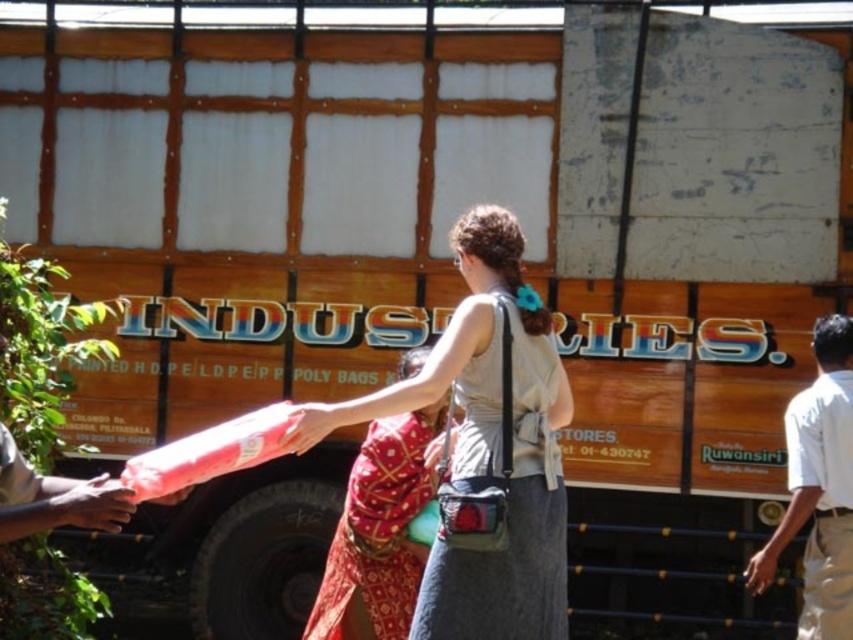
Consider the image. Can you confirm if pink fabric at center is positioned above matte black hand at lower right?

Yes, pink fabric at center is above matte black hand at lower right.

Can you confirm if pink fabric at center is positioned to the left of matte black hand at lower right?

Indeed, pink fabric at center is positioned on the left side of matte black hand at lower right.

Between point (337, 404) and point (752, 584), which one is positioned behind?

The point (337, 404) is more distant.

Find the location of a particular element. pink fabric at center is located at coordinates (309, 426).

Can you confirm if red printed pants at center is shorter than matte red bag at center?

No, red printed pants at center is not shorter than matte red bag at center.

Is point (338, 592) positioned after point (436, 468)?

Yes.

Identify the location of red printed pants at center. This screenshot has width=853, height=640. (378, 532).

Find the location of a particular element. This screenshot has width=853, height=640. red printed pants at center is located at coordinates (378, 532).

Between smooth skin hand at lower left and matte red bag at center, which one is positioned lower?

smooth skin hand at lower left is below.

Is smooth skin hand at lower left thinner than matte red bag at center?

Incorrect, smooth skin hand at lower left's width is not less than matte red bag at center's.

You are a GUI agent. You are given a task and a screenshot of the screen. Output one action in this format:
    pyautogui.click(x=<x>, y=<y>)
    Task: Click on the smooth skin hand at lower left
    
    Given the screenshot: What is the action you would take?
    pyautogui.click(x=96, y=502)